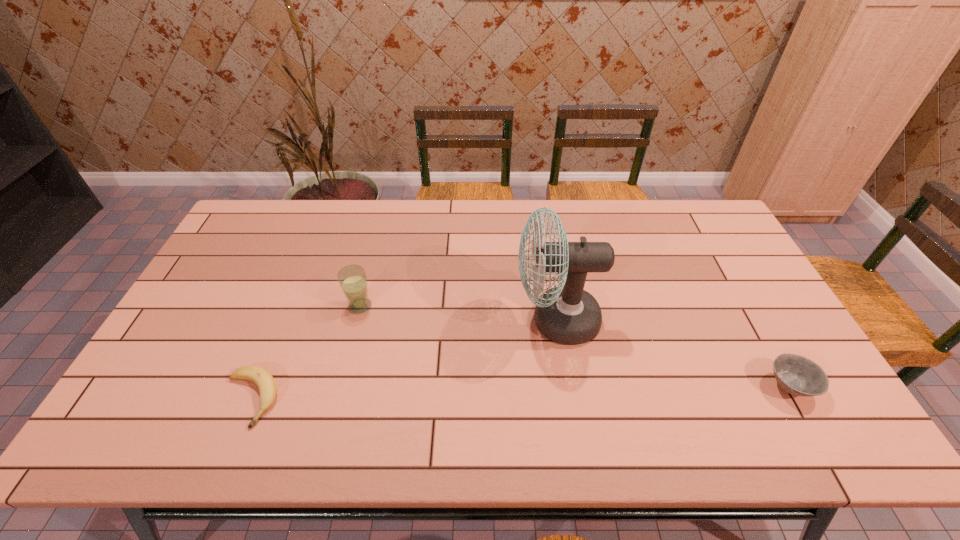
Where is `vacant area situated 0.310m in front of the third object from left to right where the airflow is directed`? The height and width of the screenshot is (540, 960). vacant area situated 0.310m in front of the third object from left to right where the airflow is directed is located at coordinates (405, 320).

Find the location of `free point located on the front of the third shortest object`. free point located on the front of the third shortest object is located at coordinates (338, 394).

Image resolution: width=960 pixels, height=540 pixels. In order to click on vacant space located on the back of the second shortest object in this screenshot , I will do `click(725, 273)`.

This screenshot has width=960, height=540. I want to click on vacant space located on the right of the banana, so click(324, 399).

I want to click on object that is at the near edge, so click(262, 378).

The width and height of the screenshot is (960, 540). Find the location of `object situated at the right edge`. object situated at the right edge is located at coordinates (797, 375).

Locate an element on the screen. Image resolution: width=960 pixels, height=540 pixels. vacant space at the far edge is located at coordinates (622, 233).

The image size is (960, 540). Identify the location of vacant space at the near edge of the desktop. (508, 443).

The image size is (960, 540). Find the location of `free region at the left edge of the desktop`. free region at the left edge of the desktop is located at coordinates (157, 381).

This screenshot has width=960, height=540. I want to click on vacant space at the right edge of the desktop, so click(x=769, y=341).